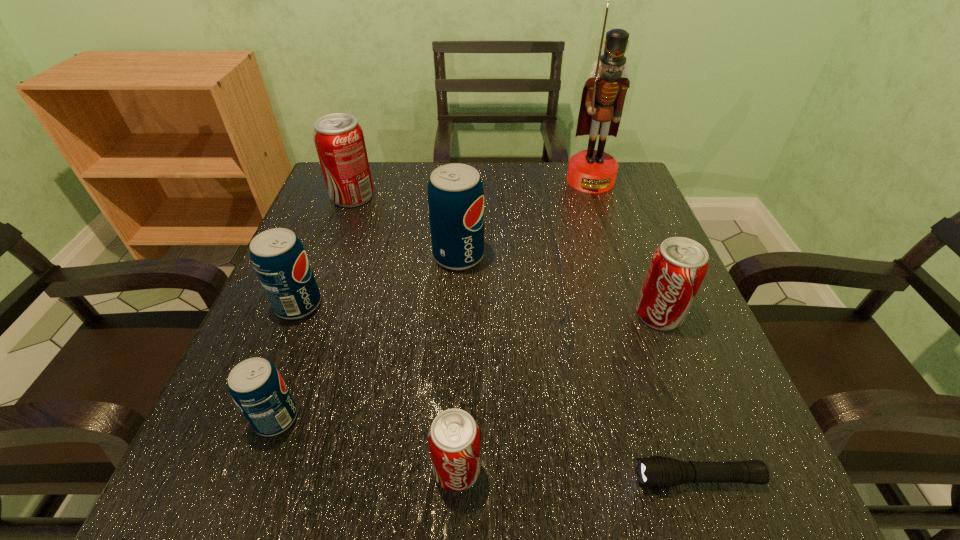
Locate which object ranks fourth in proximity to the second smallest blue pop. Please provide its 2D coordinates. Your answer should be formatted as a tuple, i.e. [(x, y)], where the tuple contains the x and y coordinates of a point satisfying the conditions above.

[(454, 438)]

Point out which soda can is positioned as the fourth nearest to the second farthest red soda can. Please provide its 2D coordinates. Your answer should be formatted as a tuple, i.e. [(x, y)], where the tuple contains the x and y coordinates of a point satisfying the conditions above.

[(279, 259)]

This screenshot has width=960, height=540. In order to click on the third closest soda can relative to the second red soda can from left to right in this screenshot , I will do `click(678, 266)`.

This screenshot has width=960, height=540. Identify the location of blue pop that is the closest one to the rightmost red soda can. (455, 191).

Identify the location of blue pop that is the second closest to the second farthest blue pop. Image resolution: width=960 pixels, height=540 pixels. (455, 191).

Select which red soda can is the closest to the rightmost soda can. Please provide its 2D coordinates. Your answer should be formatted as a tuple, i.e. [(x, y)], where the tuple contains the x and y coordinates of a point satisfying the conditions above.

[(454, 438)]

Image resolution: width=960 pixels, height=540 pixels. Identify the location of the closest red soda can to the second farthest red soda can. (454, 438).

Where is `blank space that satisfies the following two spatial constraints: 1. on the back side of the smallest blue pop; 2. on the right side of the second farthest red soda can`? Image resolution: width=960 pixels, height=540 pixels. blank space that satisfies the following two spatial constraints: 1. on the back side of the smallest blue pop; 2. on the right side of the second farthest red soda can is located at coordinates (314, 314).

You are a GUI agent. You are given a task and a screenshot of the screen. Output one action in this format:
    pyautogui.click(x=<x>, y=<y>)
    Task: Click on the vacant space that satisfies the following two spatial constraints: 1. on the front side of the second red soda can from right to left; 2. on the left side of the smallest blue pop
    Image resolution: width=960 pixels, height=540 pixels.
    Given the screenshot: What is the action you would take?
    pyautogui.click(x=257, y=470)

Locate an element on the screen. This screenshot has width=960, height=540. vacant space that satisfies the following two spatial constraints: 1. on the front side of the nearest red soda can; 2. on the right side of the farthest blue pop is located at coordinates (447, 470).